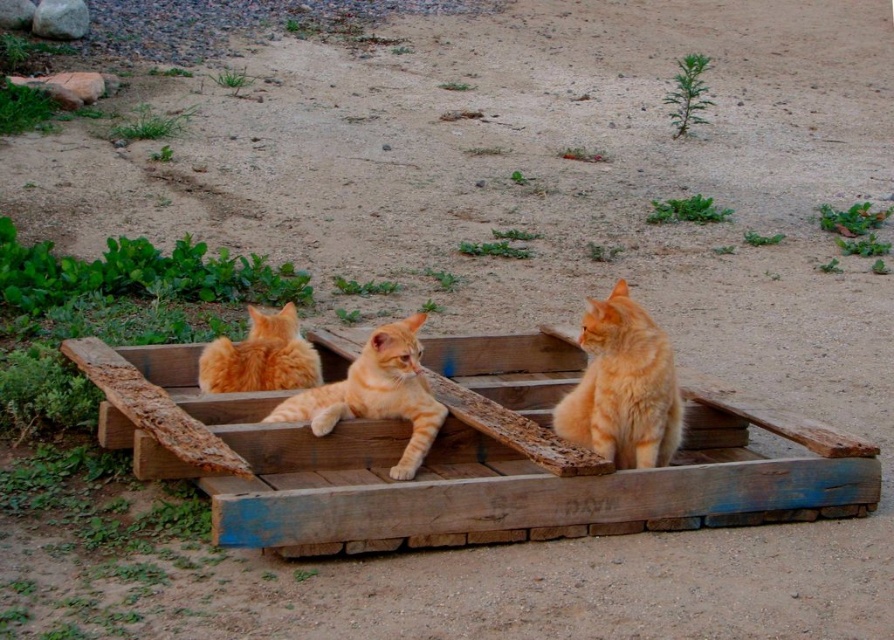
You are standing in the garden looking at the wooden pallet with the cats. There are two points marked on the pallet. Which of the two points, point (133, 369) or point (343, 387), is closer to you?

Point (133, 369) is further to the camera than point (343, 387), so the point closer to you is point (343, 387).